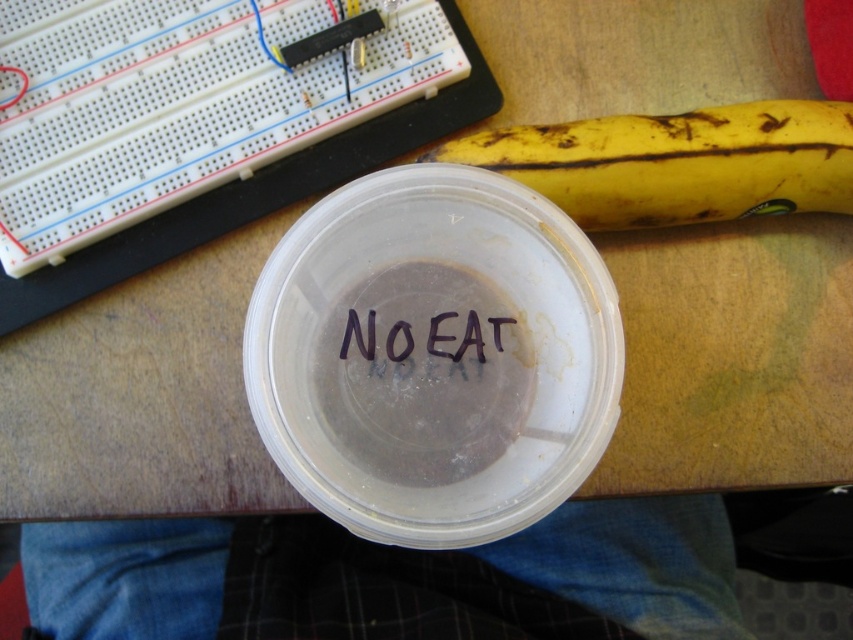
Question: Does yellow matte banana at upper right appear on the left side of black ink writing at center?

Choices:
 (A) no
 (B) yes

Answer: (A)

Question: Is yellow matte banana at upper right above black ink writing at center?

Choices:
 (A) yes
 (B) no

Answer: (A)

Question: Does yellow matte banana at upper right come in front of black ink writing at center?

Choices:
 (A) no
 (B) yes

Answer: (A)